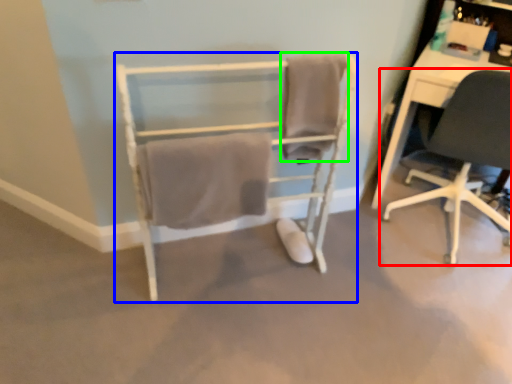
Question: Based on their relative distances, which object is nearer to chair (highlighted by a red box)? Choose from chair (highlighted by a blue box) and bath towel (highlighted by a green box).

Choices:
 (A) chair
 (B) bath towel

Answer: (B)